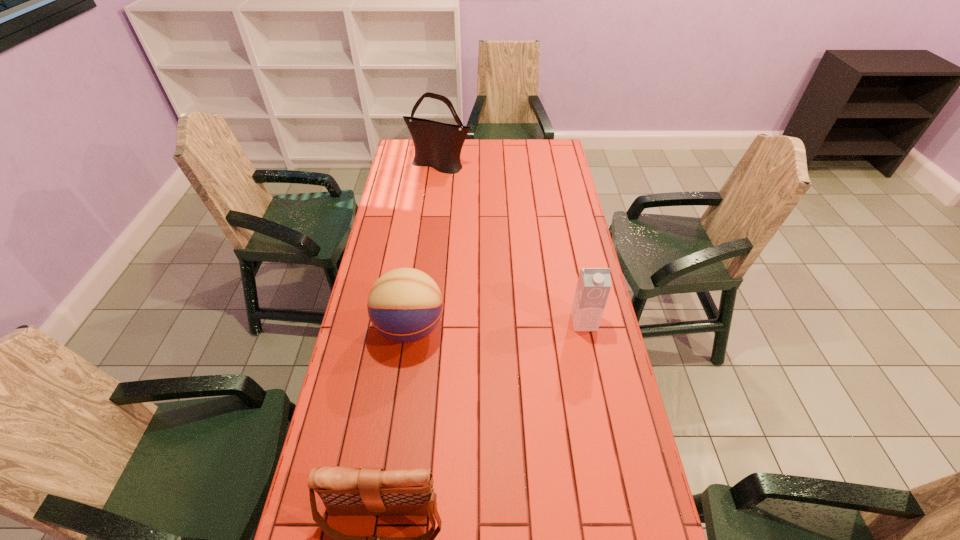
In order to click on the farther shoulder bag in this screenshot , I will do `click(438, 145)`.

This screenshot has height=540, width=960. What are the coordinates of `the taller shoulder bag` in the screenshot? It's located at (438, 145).

At what (x,y) coordinates should I click in order to perform the action: click on the rightmost object. Please return your answer as a coordinate pair (x, y). This screenshot has width=960, height=540. Looking at the image, I should click on (594, 284).

What are the coordinates of `basketball` in the screenshot? It's located at (405, 305).

Locate an element on the screen. vacant area located on the right of the tallest object is located at coordinates (516, 166).

Identify the location of vacant space located on the front label of the carton. The height and width of the screenshot is (540, 960). (595, 375).

Find the location of `vacant space located 0.300m on the patterned surface of the basketball`. vacant space located 0.300m on the patterned surface of the basketball is located at coordinates (539, 328).

Locate an element on the screen. The width and height of the screenshot is (960, 540). object located at the far edge is located at coordinates click(x=438, y=145).

Where is `shoulder bag positioned at the left edge`? The image size is (960, 540). shoulder bag positioned at the left edge is located at coordinates (438, 145).

Locate an element on the screen. basketball located at the left edge is located at coordinates [x=405, y=305].